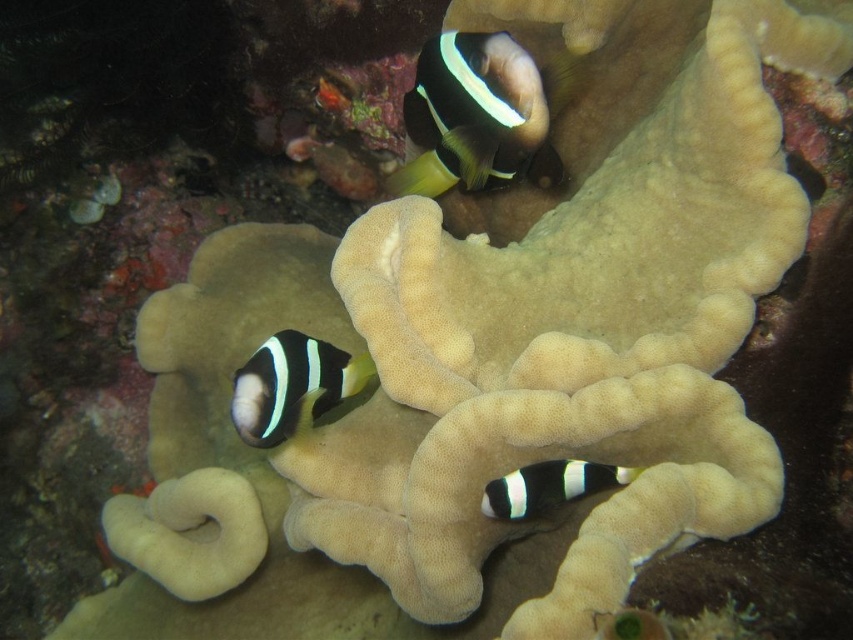
You are an underwater photographer aiming to capture a closeup shot of the black matte clownfish at upper center and the black and white striped fish at lower left. Given that your camera lens can only focus on one subject at a time, which fish should you choose to ensure the larger one is in focus?

The black matte clownfish at upper center is larger than the black and white striped fish at lower left, so you should focus on the black matte clownfish at upper center to ensure the larger one is in focus.